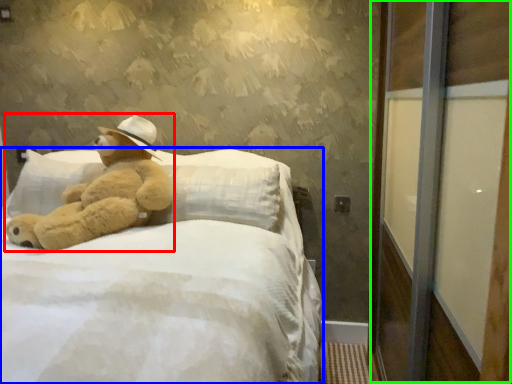
Question: Considering the real-world distances, which object is closest to teddy bear (highlighted by a red box)? bed (highlighted by a blue box) or screen door (highlighted by a green box).

Choices:
 (A) bed
 (B) screen door

Answer: (A)